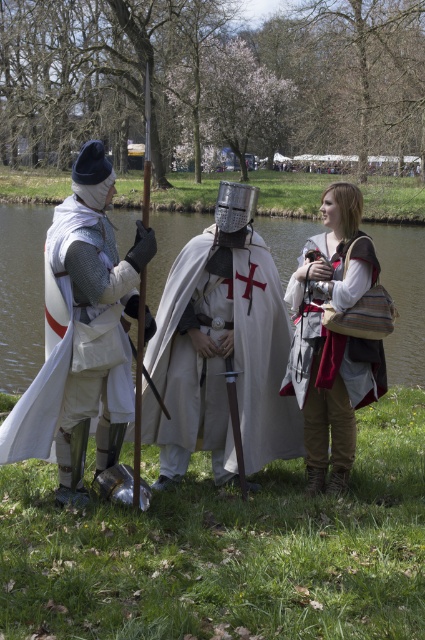
Can you confirm if matte white tunic at center is thinner than white chainmail armor at left?

Yes.

Between point (316, 358) and point (51, 241), which one is positioned in front?

Positioned in front is point (51, 241).

Locate an element on the screen. This screenshot has height=640, width=425. matte white tunic at center is located at coordinates (333, 339).

Between white cloth cape at center and matte white tunic at center, which one appears on the left side from the viewer's perspective?

white cloth cape at center

In order to click on white cloth cape at center in this screenshot , I will do coord(22,292).

At what (x,y) coordinates should I click in order to perform the action: click on white cloth cape at center. Please return your answer as a coordinate pair (x, y). This screenshot has height=640, width=425. Looking at the image, I should click on (22, 292).

Identify the location of white cloth cape at center. Image resolution: width=425 pixels, height=640 pixels. (22, 292).

Image resolution: width=425 pixels, height=640 pixels. Describe the element at coordinates (221, 358) in the screenshot. I see `white matte cape at center` at that location.

The image size is (425, 640). I want to click on white matte cape at center, so click(221, 358).